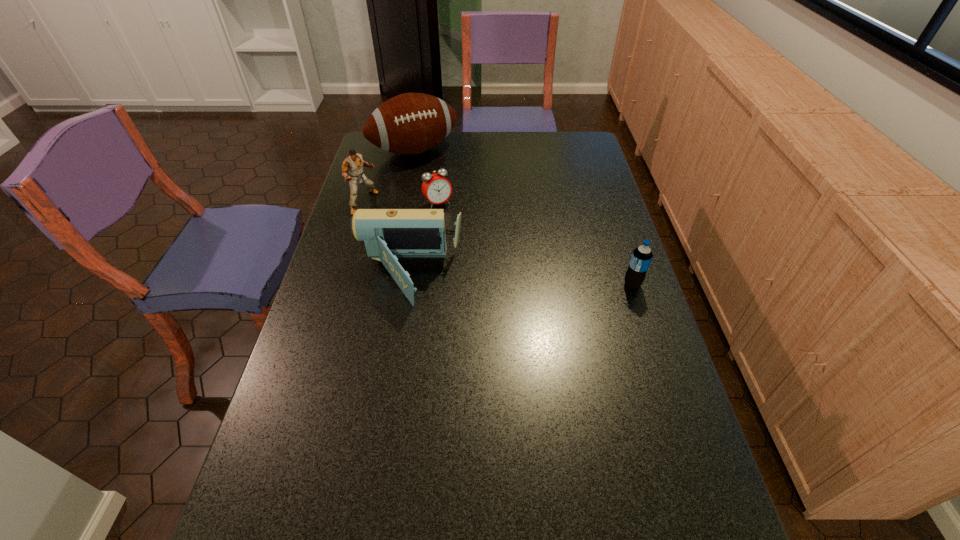
Where is `football that is at the left edge`? football that is at the left edge is located at coordinates (411, 123).

The height and width of the screenshot is (540, 960). I want to click on object at the right edge, so click(x=641, y=257).

Where is `object present at the far left corner`? This screenshot has height=540, width=960. object present at the far left corner is located at coordinates (411, 123).

Locate an element on the screen. Image resolution: width=960 pixels, height=540 pixels. free space at the far edge of the desktop is located at coordinates pyautogui.click(x=462, y=154).

In order to click on vacant area at the near edge in this screenshot , I will do `click(365, 497)`.

Find the location of a particular element. The image size is (960, 540). vacant space at the left edge of the desktop is located at coordinates (350, 242).

This screenshot has width=960, height=540. I want to click on free region at the right edge of the desktop, so click(x=646, y=428).

Where is `free point between the rightmost object and the alarm clock`? This screenshot has height=540, width=960. free point between the rightmost object and the alarm clock is located at coordinates (535, 244).

Locate an element on the screen. The height and width of the screenshot is (540, 960). free spot between the puncher and the soda bottle is located at coordinates (498, 244).

Locate an element on the screen. Image resolution: width=960 pixels, height=540 pixels. vacant space that is in between the rightmost object and the puncher is located at coordinates (498, 244).